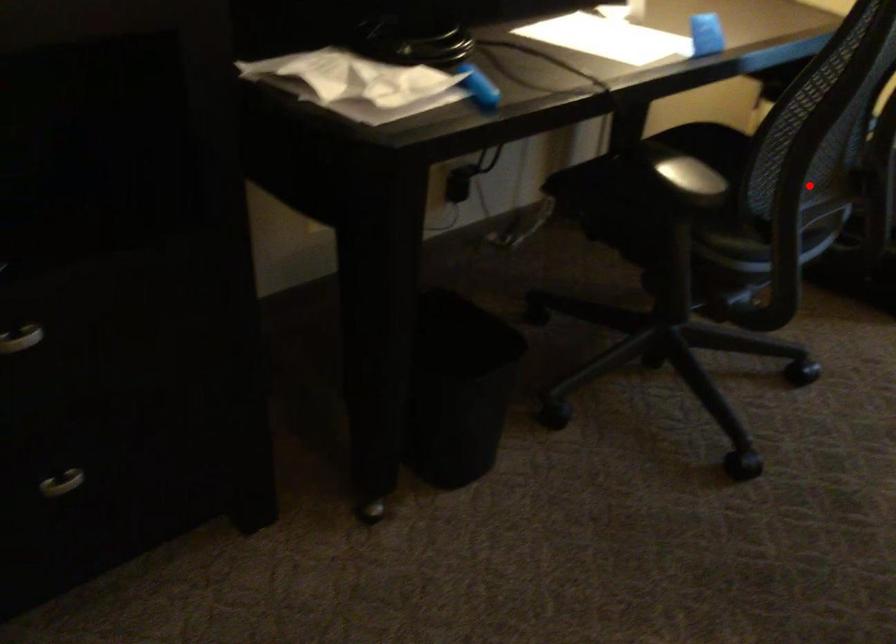
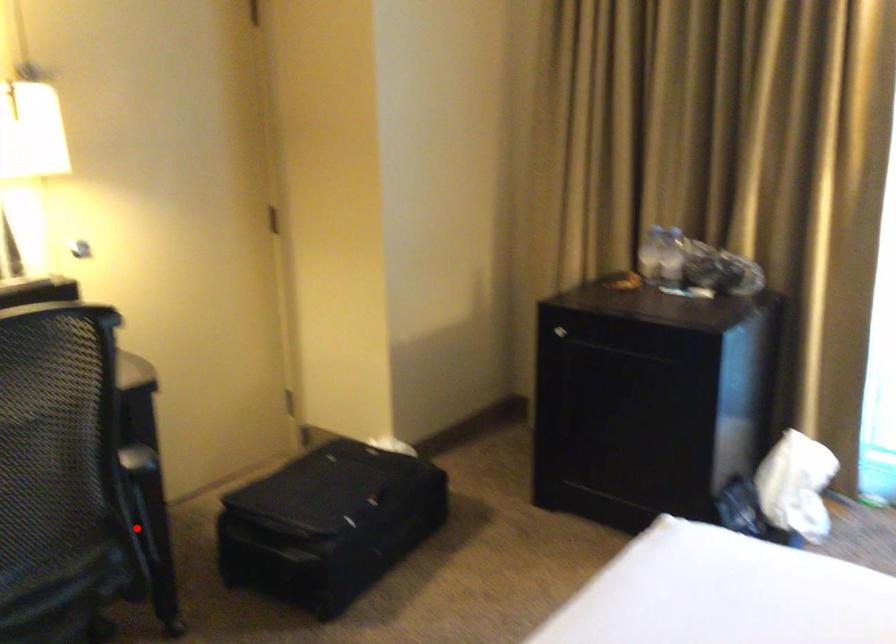
Looking at this image, I am providing you with two images of the same scene from different viewpoints. A red point is marked on the first image and another point is marked on the second image. Is the red point in image1 aligned with the point shown in image2?

Yes